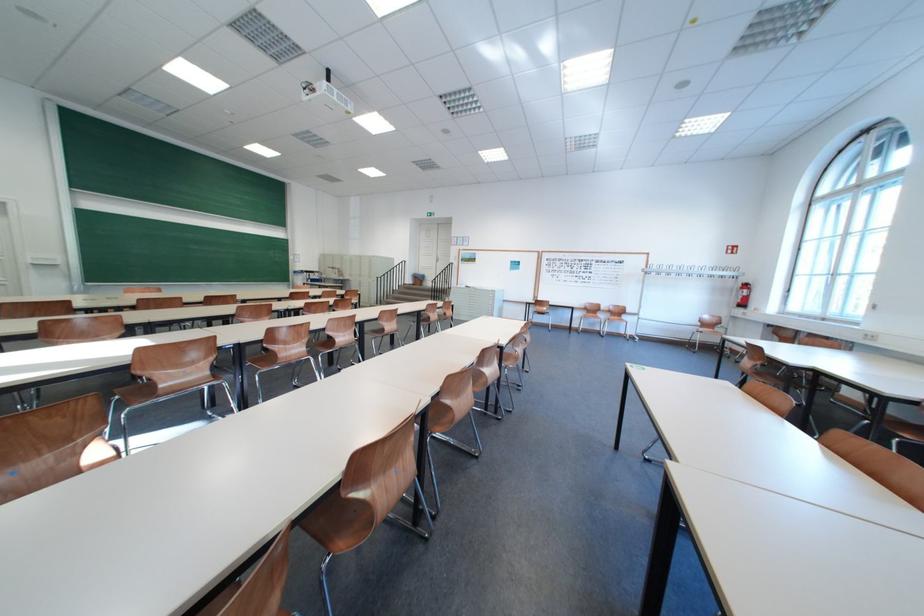
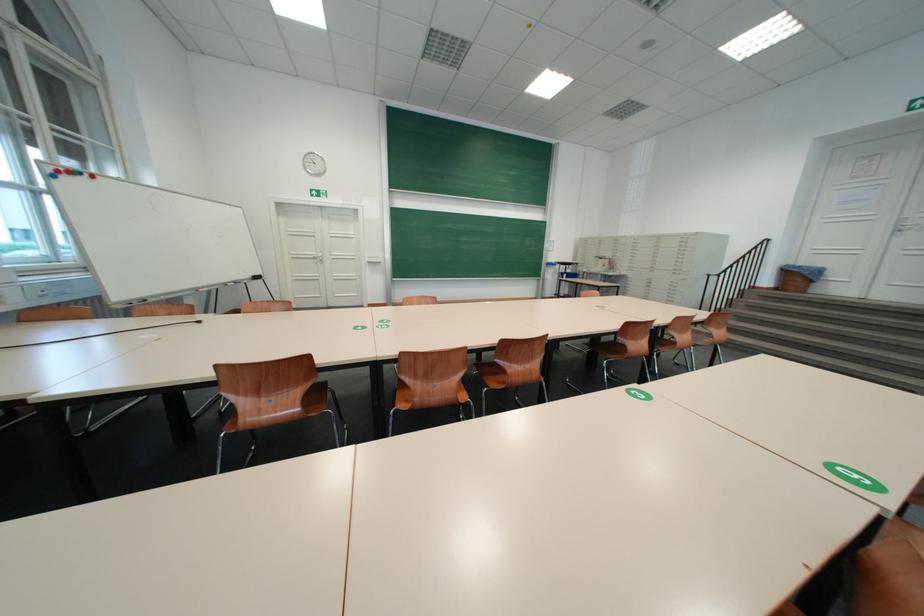
Locate, in the second image, the point that corresponds to [423,283] in the first image.

(781, 283)